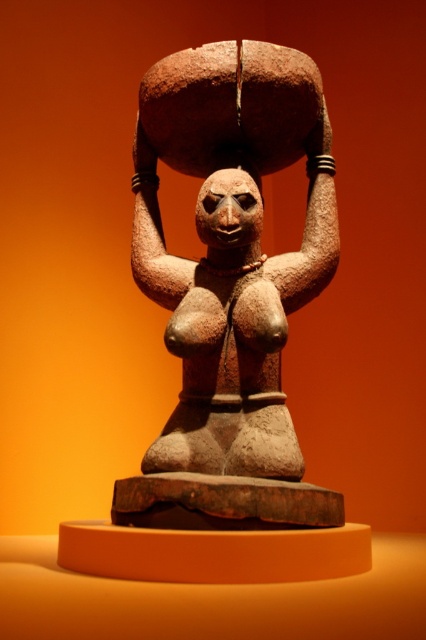
Question: Is brown stone statue at center to the right of matte brown head at center from the viewer's perspective?

Choices:
 (A) no
 (B) yes

Answer: (A)

Question: Which object appears farthest from the camera in this image?

Choices:
 (A) brown stone statue at center
 (B) matte brown head at center

Answer: (B)

Question: Which of the following is the farthest from the observer?

Choices:
 (A) (178, 60)
 (B) (210, 209)

Answer: (A)

Question: From the image, what is the correct spatial relationship of brown stone statue at center in relation to matte brown head at center?

Choices:
 (A) right
 (B) left

Answer: (B)

Question: Can you confirm if brown stone statue at center is smaller than matte brown head at center?

Choices:
 (A) no
 (B) yes

Answer: (A)